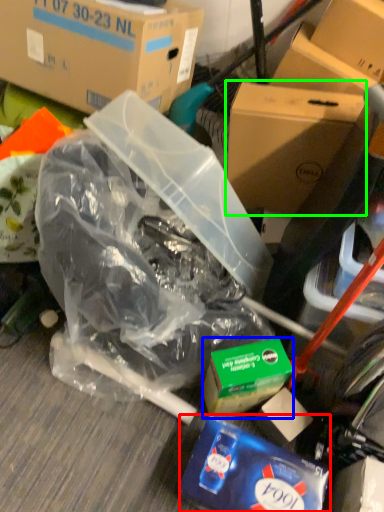
Question: Which object is the farthest from waste (highlighted by a red box)? Choose among these: product (highlighted by a blue box) or box (highlighted by a green box).

Choices:
 (A) product
 (B) box

Answer: (B)